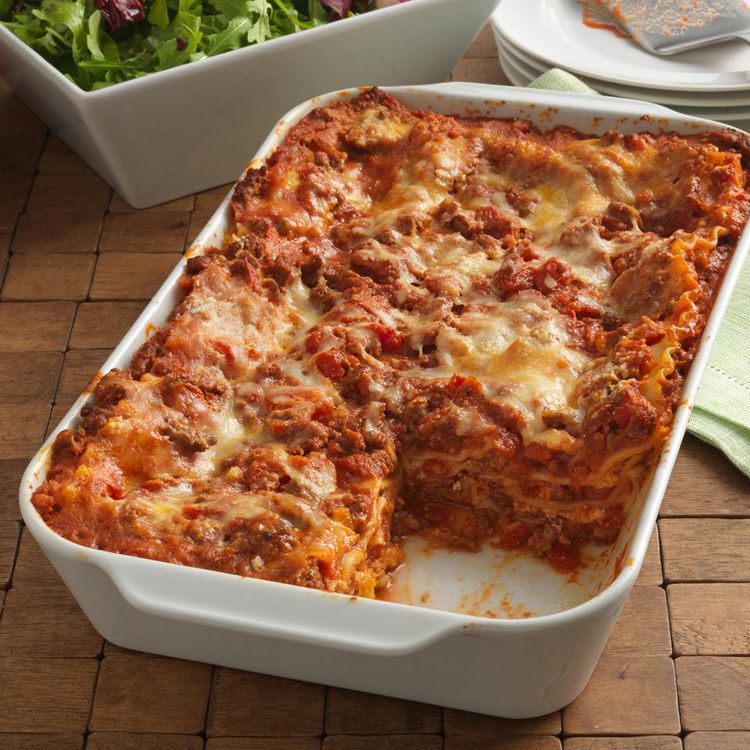
Where is `dish`? dish is located at coordinates (662, 74), (728, 100), (739, 112), (510, 75).